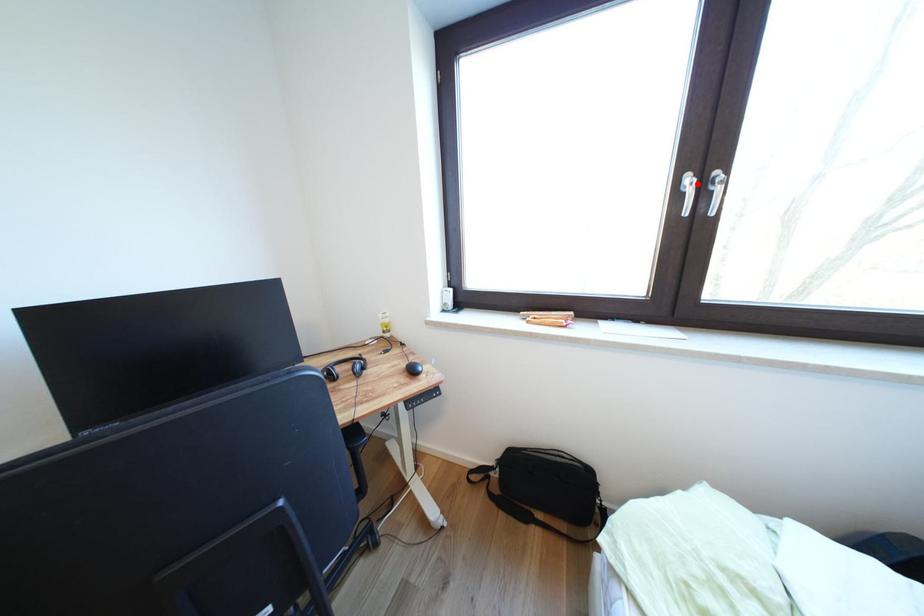
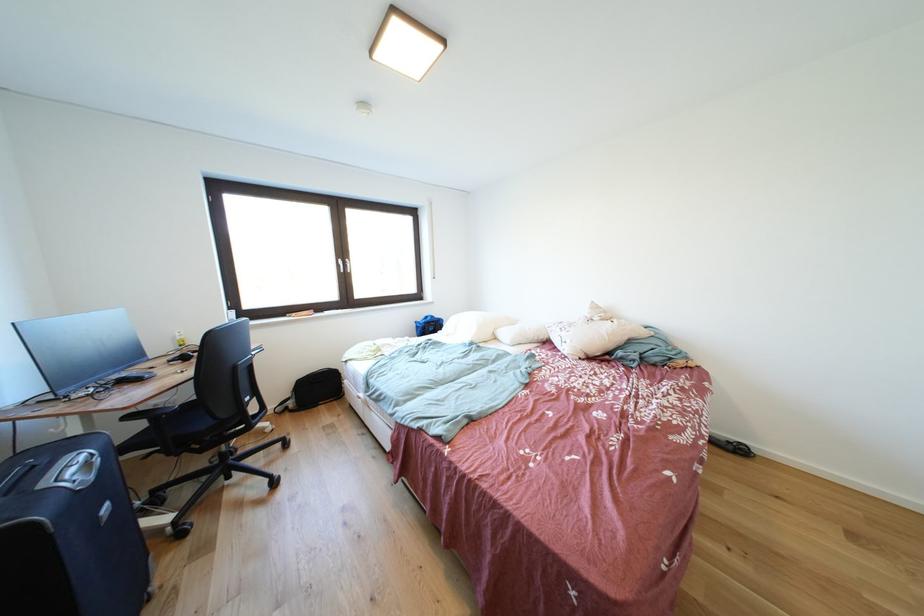
Where in the second image is the point corresponding to the highlighted location from the first image?

(348, 265)